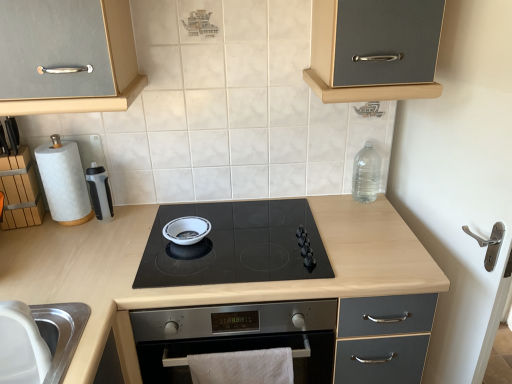
The image size is (512, 384). Identify the location of empty space that is in between clear plastic bottle at upper right and white paper towel at left. (248, 213).